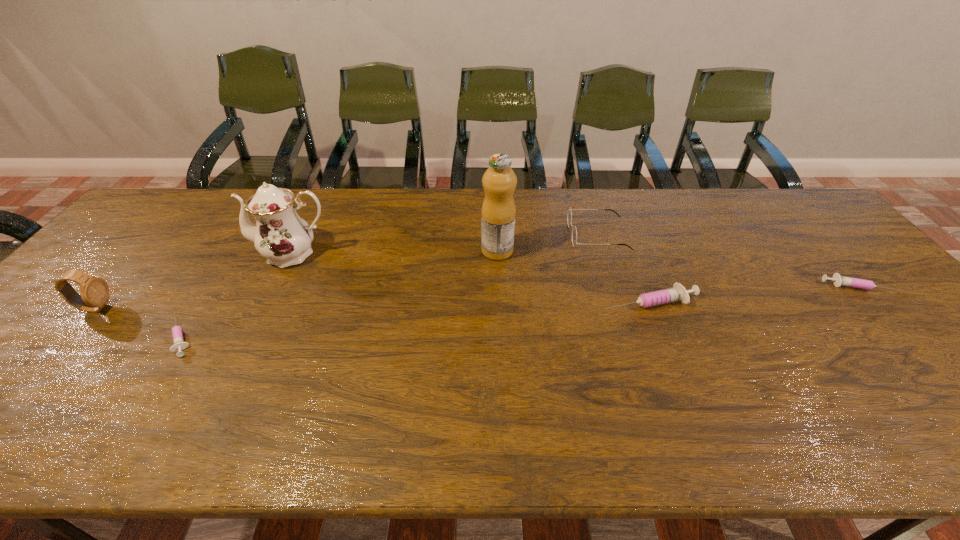
Locate an element on the screen. The image size is (960, 540). vacant region located 0.330m on the face of the watch is located at coordinates (239, 308).

Find the location of a particular element. The image size is (960, 540). vacant space located on the front label of the fourth object from left to right is located at coordinates (420, 251).

Image resolution: width=960 pixels, height=540 pixels. Find the location of `free spot located on the front label of the fourth object from left to right`. free spot located on the front label of the fourth object from left to right is located at coordinates (353, 251).

You are a GUI agent. You are given a task and a screenshot of the screen. Output one action in this format:
    pyautogui.click(x=<x>, y=<y>)
    Task: Click on the free location located 0.200m on the front label of the fourth object from left to right
    This screenshot has height=540, width=960.
    Given the screenshot: What is the action you would take?
    pyautogui.click(x=414, y=251)

Find the location of a particular element. object that is at the far edge is located at coordinates (569, 215).

The width and height of the screenshot is (960, 540). Identify the location of object positioned at the left edge. (x=94, y=291).

Where is `object that is at the right edge`? object that is at the right edge is located at coordinates (838, 280).

At what (x,y) coordinates should I click in order to perform the action: click on free location at the far edge. Please return your answer as a coordinate pair (x, y). This screenshot has height=540, width=960. Looking at the image, I should click on (635, 197).

Find the location of a particular element. This screenshot has height=540, width=960. free space at the near edge is located at coordinates (842, 392).

You are a GUI agent. You are given a task and a screenshot of the screen. Output one action in this format:
    pyautogui.click(x=<x>, y=<y>)
    Task: Click on the vacant space at the left edge
    The image size is (960, 540).
    Given the screenshot: What is the action you would take?
    pyautogui.click(x=30, y=366)